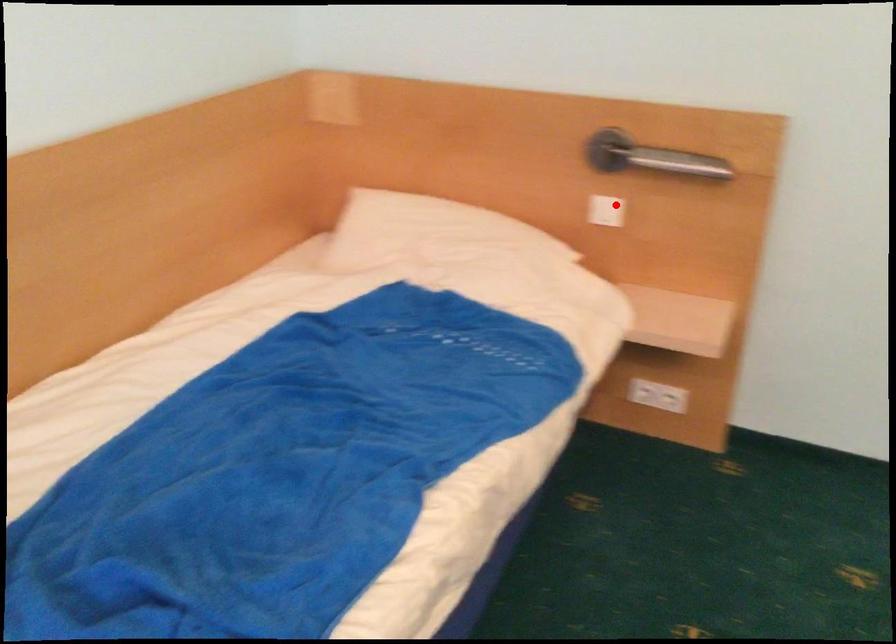
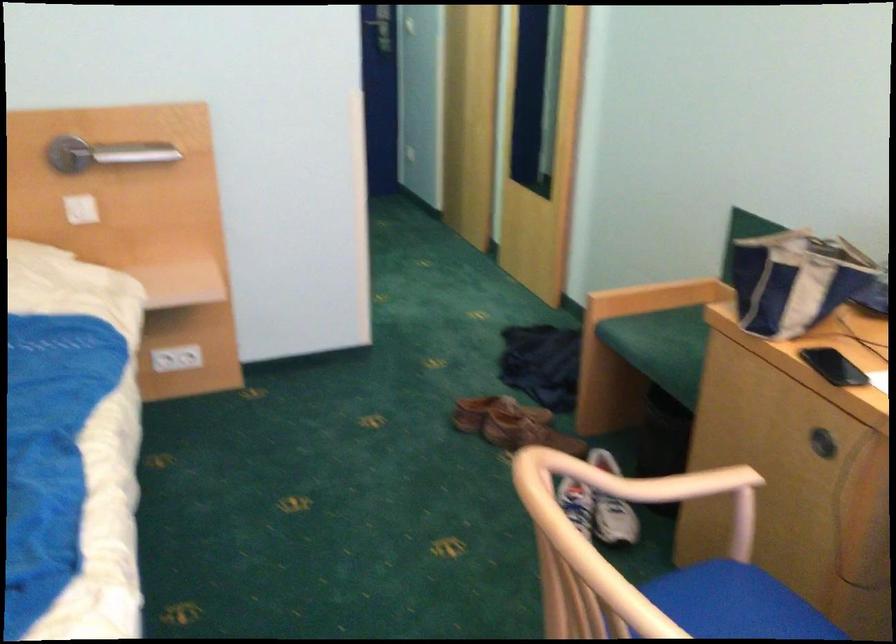
Question: I am providing you with two images of the same scene from different viewpoints. In image1, a red point is highlighted. Considering the same 3D point in image2, which of the following is correct?

Choices:
 (A) It is closer
 (B) It is farther

Answer: (B)